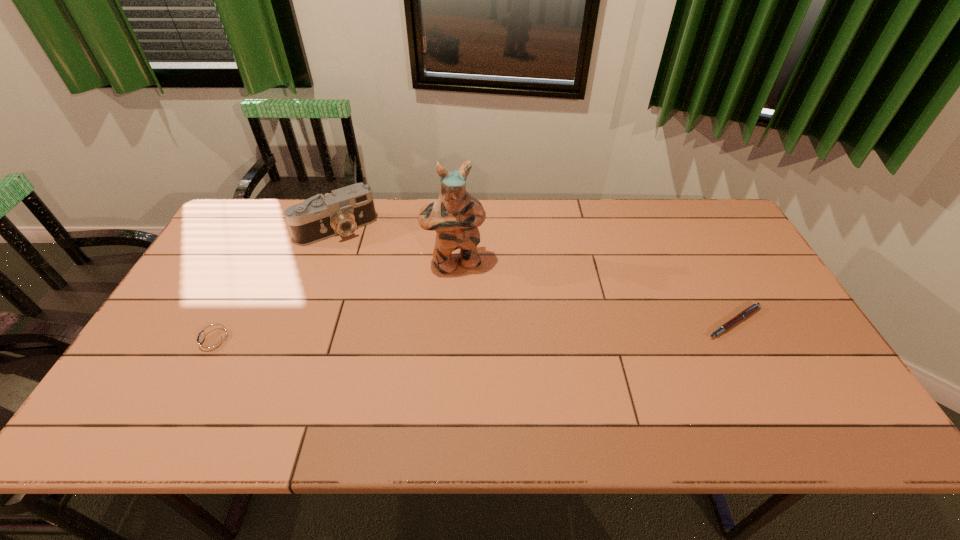
In the image, there is a desktop. Where is `vacant space at the near edge`? This screenshot has width=960, height=540. vacant space at the near edge is located at coordinates (353, 370).

Where is `vacant area at the right edge`? Image resolution: width=960 pixels, height=540 pixels. vacant area at the right edge is located at coordinates (729, 261).

You are a GUI agent. You are given a task and a screenshot of the screen. Output one action in this format:
    pyautogui.click(x=<x>, y=<y>)
    Task: Click on the vacant space at the far left corner
    This screenshot has width=960, height=540.
    Given the screenshot: What is the action you would take?
    pyautogui.click(x=274, y=223)

Locate an element on the screen. The image size is (960, 540). vacant space at the near right corner is located at coordinates (820, 379).

You are a GUI agent. You are given a task and a screenshot of the screen. Output one action in this format:
    pyautogui.click(x=<x>, y=<y>)
    Task: Click on the free space between the third tallest object and the pen
    
    Given the screenshot: What is the action you would take?
    pyautogui.click(x=473, y=332)

Identify the location of free point between the pen and the second object from left to right. This screenshot has height=540, width=960. (536, 275).

The image size is (960, 540). In order to click on free space between the pen and the leftmost object in this screenshot , I will do `click(473, 332)`.

Locate an element on the screen. Image resolution: width=960 pixels, height=540 pixels. free space between the third shortest object and the watch is located at coordinates (275, 285).

Locate an element on the screen. This screenshot has height=540, width=960. empty space that is in between the second farthest object and the leftmost object is located at coordinates (334, 302).

Locate an element on the screen. Image resolution: width=960 pixels, height=540 pixels. vacant area that lies between the second tallest object and the second object from right to left is located at coordinates (396, 246).